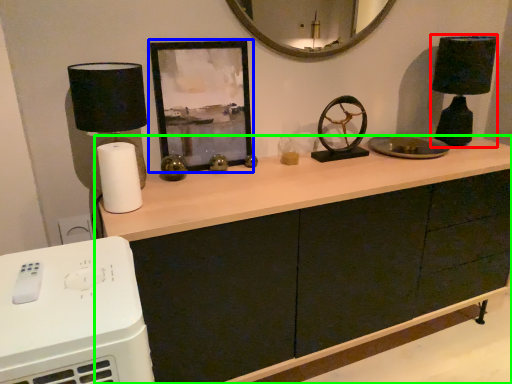
Question: Estimate the real-world distances between objects in this image. Which object is closer to table lamp (highlighted by a red box), picture frame (highlighted by a blue box) or cabinetry (highlighted by a green box)?

Choices:
 (A) picture frame
 (B) cabinetry

Answer: (B)